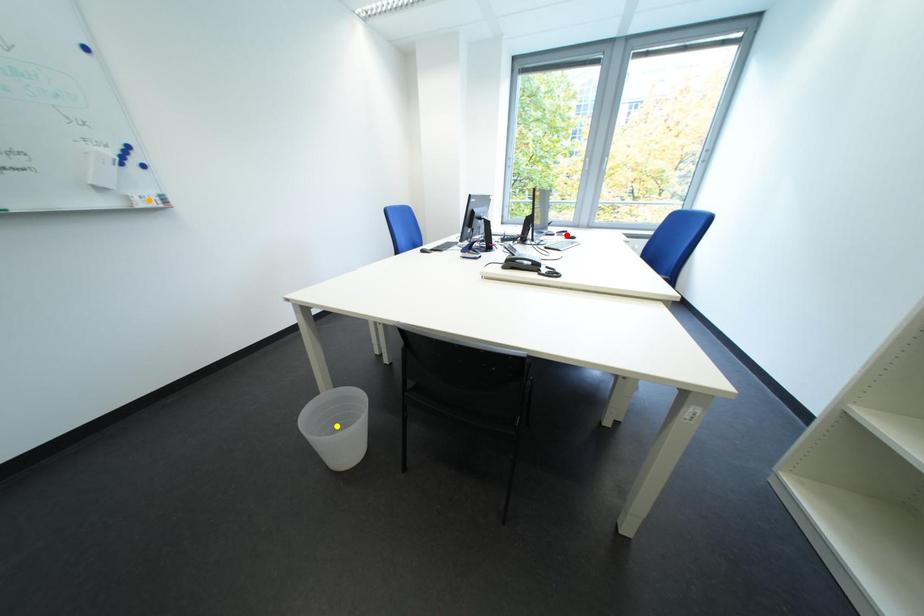
Order these from nearest to farthest:
A) red point
B) orange point
C) yellow point

yellow point
orange point
red point